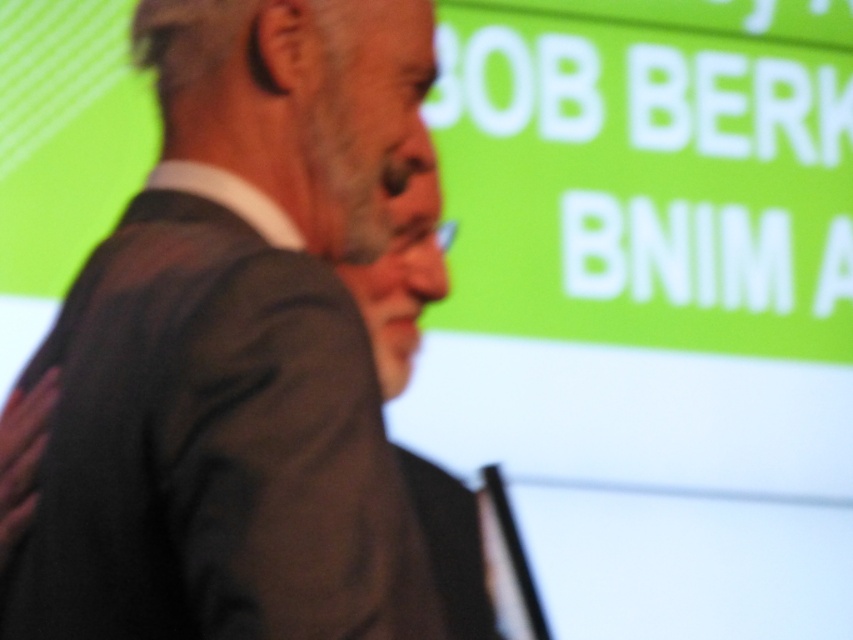
You are a photographer at a conference and need to adjust the camera focus to capture both the dark gray suit at center and the matte black suit at center clearly. Given their sizes, which suit should you prioritize focusing on first to ensure proper framing?

The dark gray suit at center is wider than the matte black suit at center, so you should prioritize focusing on the dark gray suit at center first to ensure it fits within the frame properly.

You are an event photographer at the conference. You need to capture a photo of the two people wearing the dark gray suit at center and the matte black suit at center. Which one is positioned to the left of the other?

The dark gray suit at center is positioned to the left of the matte black suit at center.